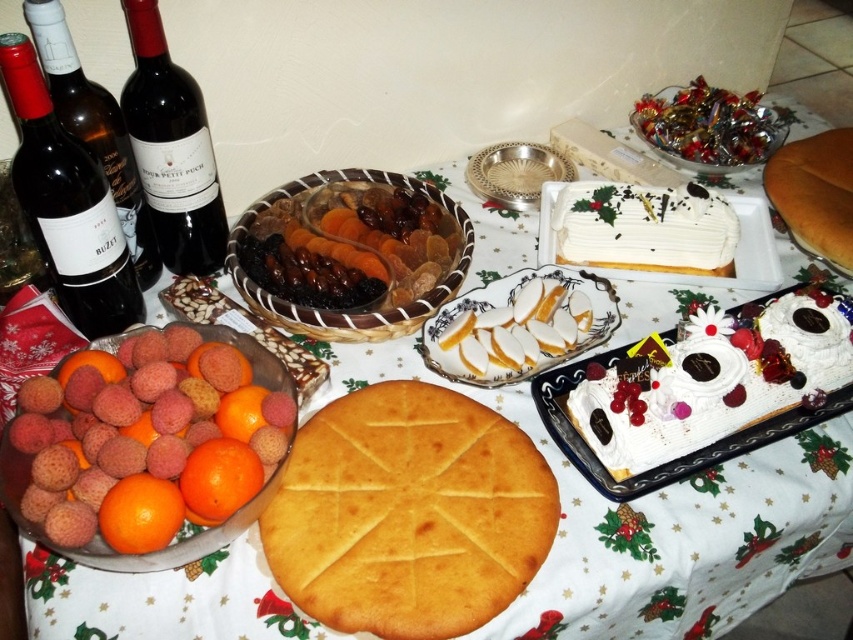
Between white glossy platter at center and matte glass bottle at left, which one is positioned lower?

white glossy platter at center

Is white glossy platter at center to the left of matte glass bottle at left from the viewer's perspective?

Incorrect, white glossy platter at center is not on the left side of matte glass bottle at left.

Describe the element at coordinates (519, 324) in the screenshot. This screenshot has height=640, width=853. I see `white glossy platter at center` at that location.

This screenshot has width=853, height=640. What are the coordinates of `white glossy platter at center` in the screenshot? It's located at (519, 324).

Between point (720, 225) and point (109, 112), which one is positioned in front?

Point (109, 112) is in front.

Can you confirm if white cream cake at center is positioned above matte glass bottle at left?

No.

Is point (682, 224) closer to viewer compared to point (100, 99)?

That is False.

Find the location of a particular element. This screenshot has width=853, height=640. white cream cake at center is located at coordinates (643, 227).

Which is above, white cream cake at lower right or white cream cake at center?

white cream cake at center

Between white cream cake at lower right and white cream cake at center, which one appears on the right side from the viewer's perspective?

From the viewer's perspective, white cream cake at lower right appears more on the right side.

Which is behind, point (776, 314) or point (584, 193)?

The point (584, 193) is behind.

Where is `white cream cake at lower right`? white cream cake at lower right is located at coordinates (717, 387).